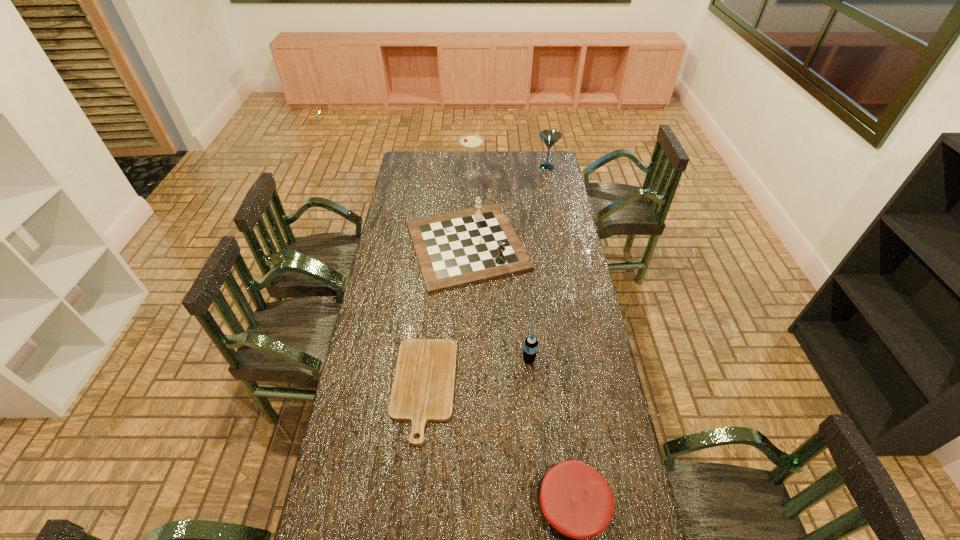
Locate an element on the screen. The height and width of the screenshot is (540, 960). the second closest object to the cap is located at coordinates (530, 346).

Identify which object is the fifth closest to the fourth nearest object. Please provide its 2D coordinates. Your answer should be formatted as a tuple, i.e. [(x, y)], where the tuple contains the x and y coordinates of a point satisfying the conditions above.

[(576, 500)]